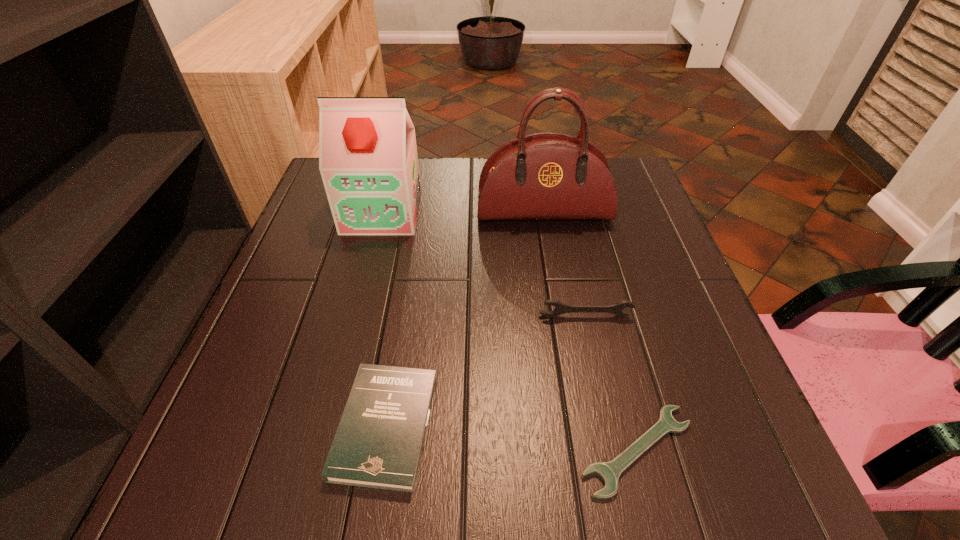
This screenshot has width=960, height=540. Identify the location of vacant space located on the left of the book. (259, 426).

What are the coordinates of `vacant space located 0.320m on the left of the shortest object` in the screenshot? It's located at (372, 450).

Image resolution: width=960 pixels, height=540 pixels. Identify the location of handbag at the far edge. pos(545,176).

I want to click on soya milk at the far edge, so click(x=368, y=161).

Where is `book present at the near edge`? The width and height of the screenshot is (960, 540). book present at the near edge is located at coordinates (378, 444).

Find the location of a particular element. This screenshot has width=960, height=540. wrench present at the near edge is located at coordinates (609, 472).

Locate an element on the screen. The height and width of the screenshot is (540, 960). object located in the left edge section of the desktop is located at coordinates 368,161.

Find the location of `handbag present at the right edge`. handbag present at the right edge is located at coordinates (545, 176).

At what (x,y) coordinates should I click in order to perform the action: click on object that is at the far left corner. Please return your answer as a coordinate pair (x, y). Looking at the image, I should click on (368, 161).

Identify the location of object located in the far right corner section of the desktop. (545, 176).